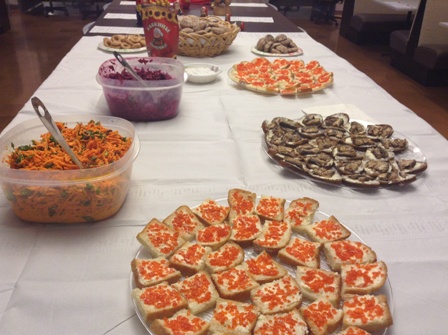
I want to click on plate, so click(288, 54).